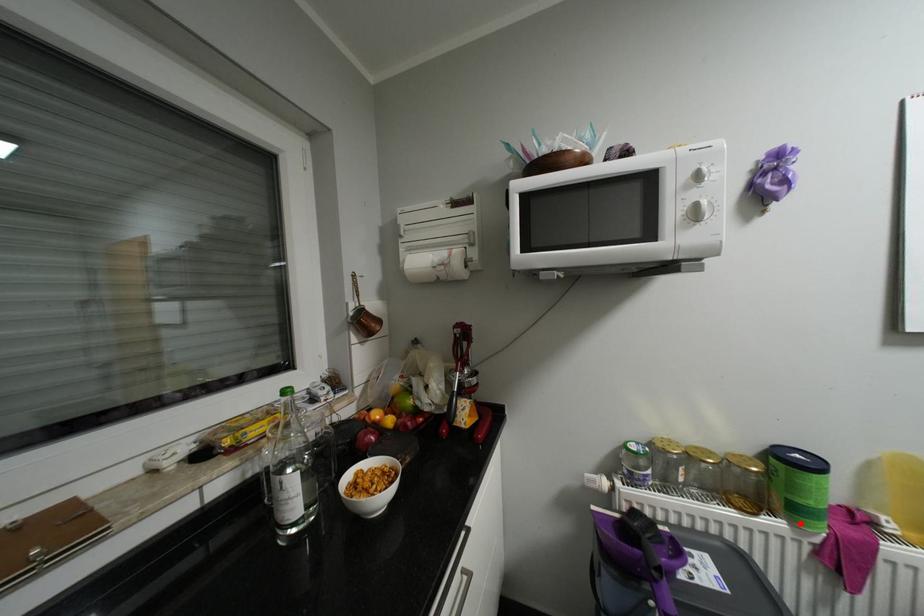
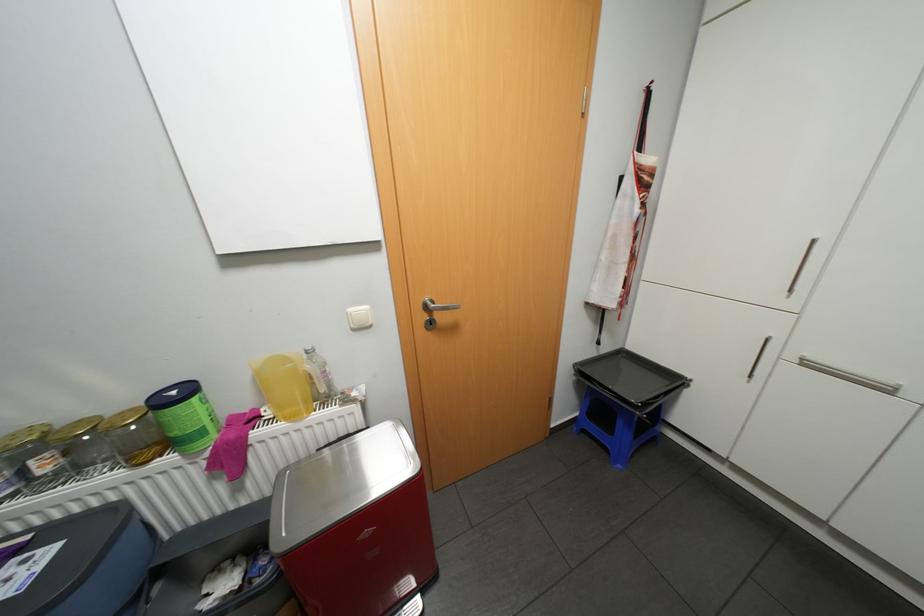
Where in the second image is the point corresponding to the highlighted location from the first image?

(190, 453)